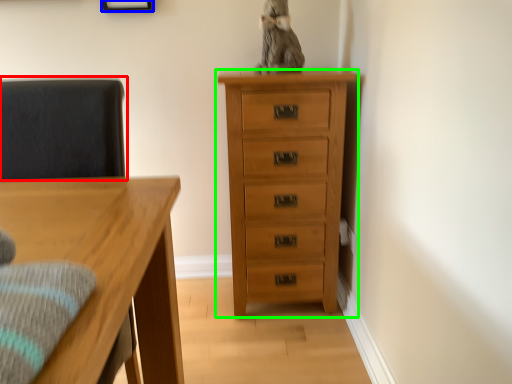
Question: Which is nearer to the swivel chair (highlighted by a red box)? picture frame (highlighted by a blue box) or chest of drawers (highlighted by a green box).

Choices:
 (A) picture frame
 (B) chest of drawers

Answer: (B)